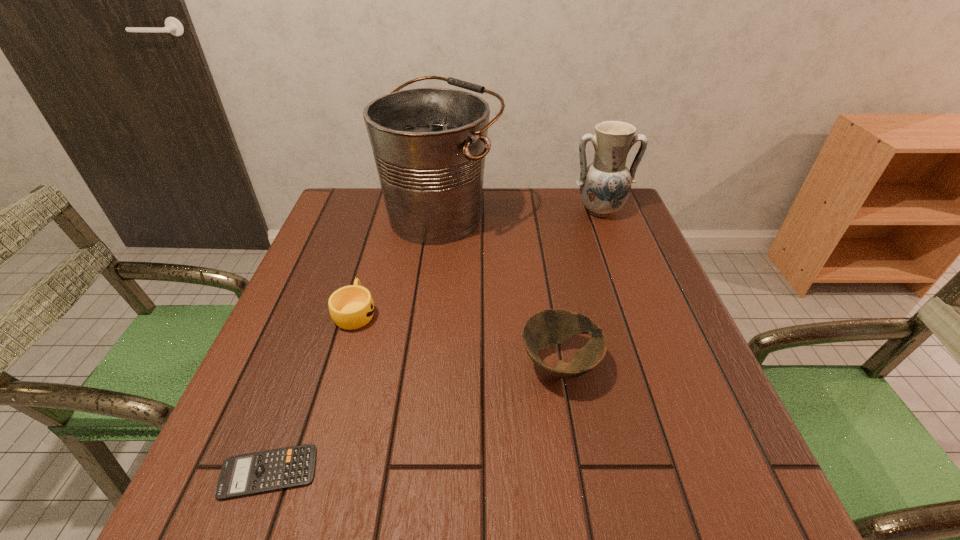
Where is `free space between the shortest object and the third tallest object`? free space between the shortest object and the third tallest object is located at coordinates (414, 418).

I want to click on free space between the second object from right to left and the tallest object, so click(x=500, y=290).

The width and height of the screenshot is (960, 540). I want to click on free area in between the third shortest object and the second tallest object, so click(x=580, y=287).

Where is `unoccupied area between the shortest object and the cup`? This screenshot has width=960, height=540. unoccupied area between the shortest object and the cup is located at coordinates (312, 392).

Find the location of `vacant space that's between the pottery and the cup`. vacant space that's between the pottery and the cup is located at coordinates (478, 261).

This screenshot has height=540, width=960. What are the coordinates of `free spot between the pottery and the third shortest object` in the screenshot? It's located at (580, 287).

Identify the location of blank region between the tallest object and the calculator. This screenshot has height=540, width=960. (355, 343).

The image size is (960, 540). Identify the location of free area in between the pottery and the bucket. pos(520,213).

This screenshot has height=540, width=960. Identify the location of vacant space that is in between the tallest object and the second shortest object. (398, 264).

Locate an element on the screen. vacant point located between the cup and the rightmost object is located at coordinates (478, 261).